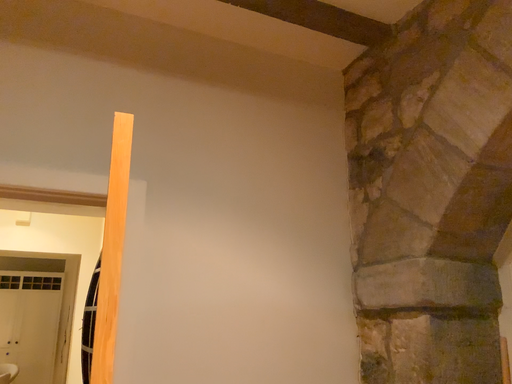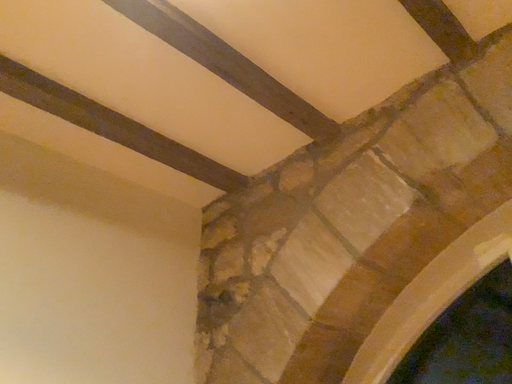
Question: How did the camera likely rotate when shooting the video?

Choices:
 (A) rotated right
 (B) rotated left

Answer: (A)